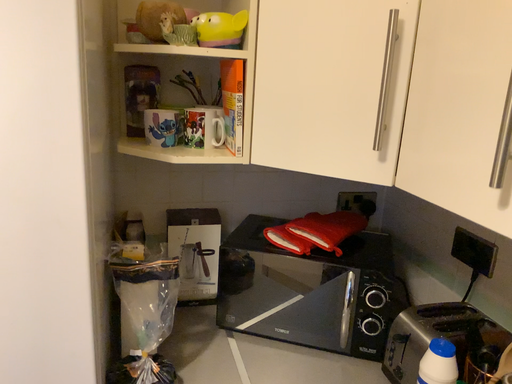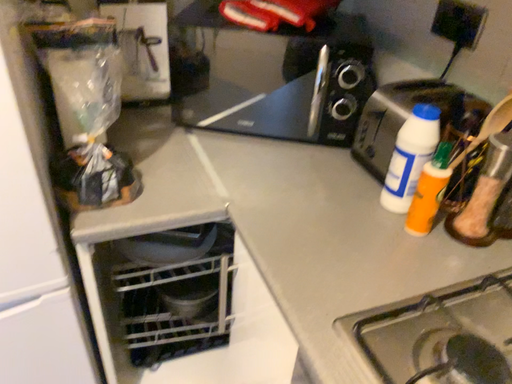
Question: Which way did the camera rotate in the video?

Choices:
 (A) rotated right
 (B) rotated left

Answer: (A)